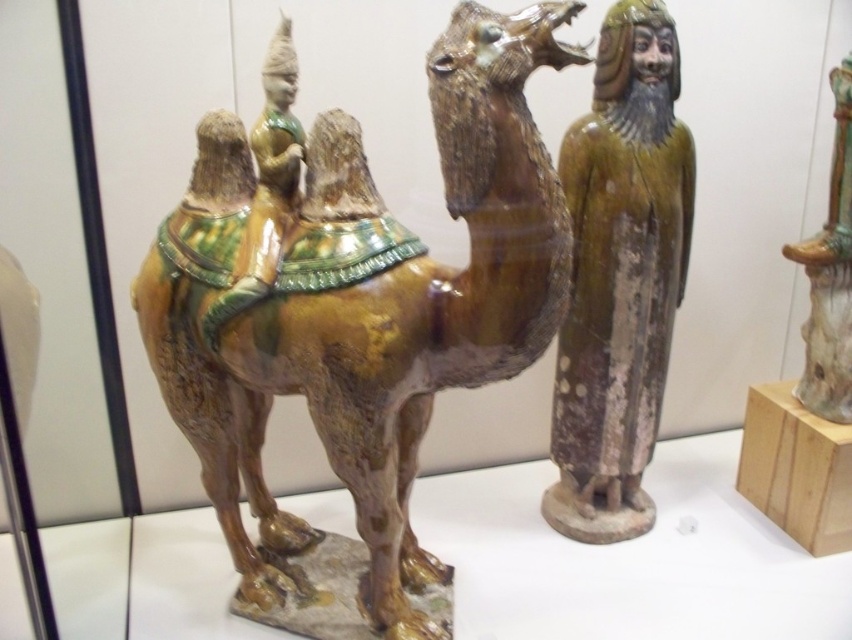
What do you see at coordinates (366, 305) in the screenshot?
I see `brown glossy camel at center` at bounding box center [366, 305].

Can you confirm if brown glossy camel at center is positioned to the right of green glazed figure at center?

Incorrect, brown glossy camel at center is not on the right side of green glazed figure at center.

Between point (334, 115) and point (661, 38), which one is positioned in front?

Positioned in front is point (334, 115).

Locate an element on the screen. The width and height of the screenshot is (852, 640). brown glossy camel at center is located at coordinates (366, 305).

Between brown glossy camel at center and shiny green ceramic vase at upper right, which one is positioned higher?

shiny green ceramic vase at upper right is higher up.

Is point (413, 326) behind point (803, 339)?

No, (413, 326) is in front of (803, 339).

In the scene shown: Who is more distant from viewer, (527, 305) or (845, 220)?

Positioned behind is point (845, 220).

The height and width of the screenshot is (640, 852). I want to click on brown glossy camel at center, so click(x=366, y=305).

From the picture: Is green glazed figure at center further to the viewer compared to shiny green ceramic vase at upper right?

No, it is not.

This screenshot has height=640, width=852. Describe the element at coordinates (620, 276) in the screenshot. I see `green glazed figure at center` at that location.

This screenshot has height=640, width=852. I want to click on green glazed figure at center, so click(x=620, y=276).